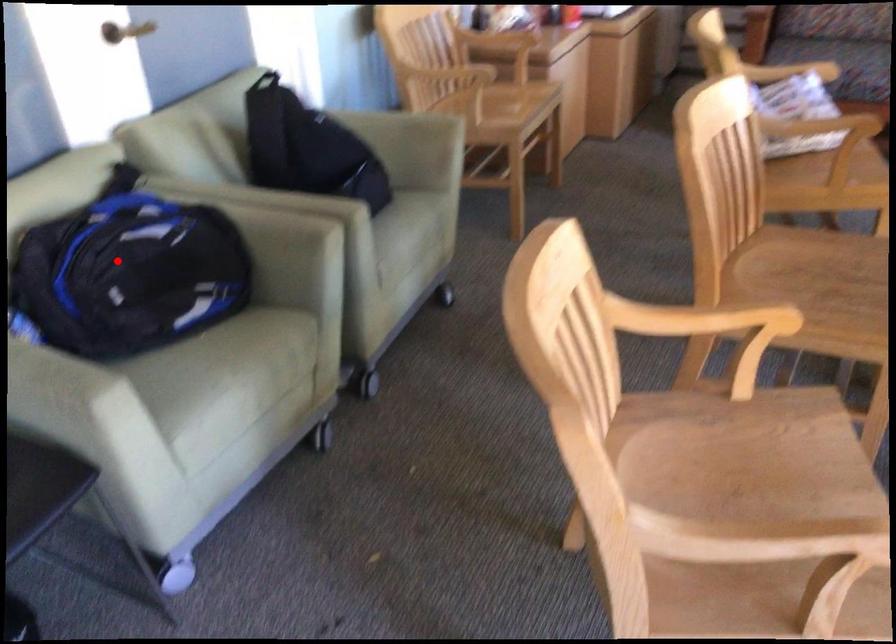
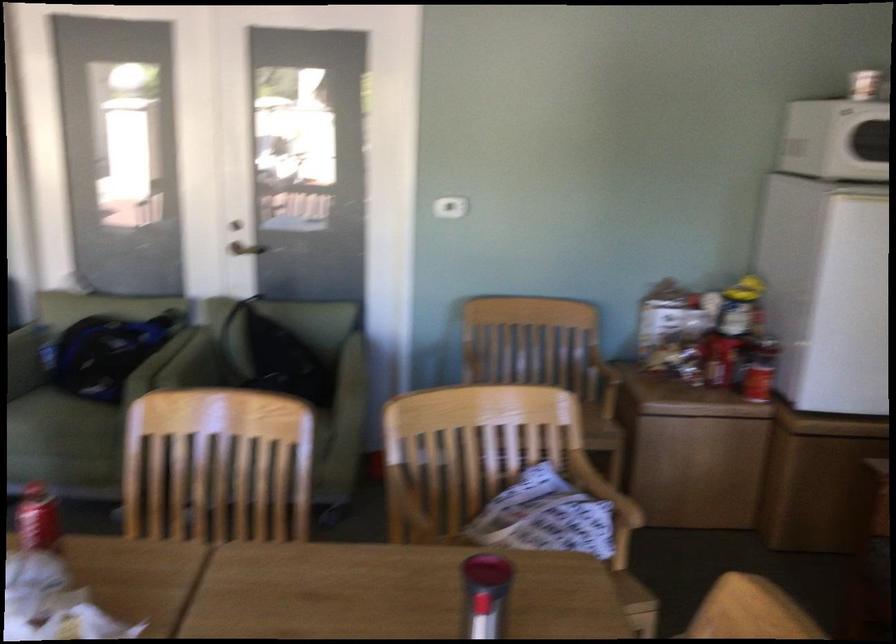
Question: A red point is marked in image1. In image2, is the corresponding 3D point closer to the camera or farther? Reply with the corresponding letter.

Choices:
 (A) The corresponding 3D point is closer.
 (B) The corresponding 3D point is farther.

Answer: (B)